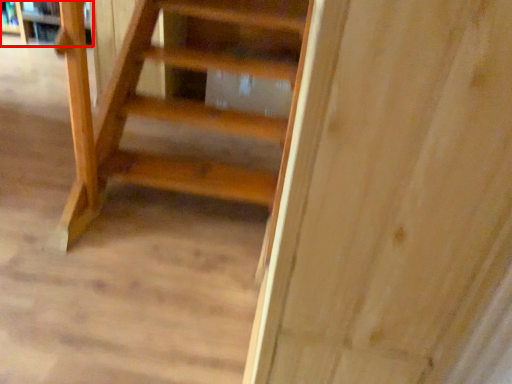
Question: Considering the relative positions of shelf (annotated by the red box) and book in the image provided, where is shelf (annotated by the red box) located with respect to the staircase?

Choices:
 (A) right
 (B) left

Answer: (A)